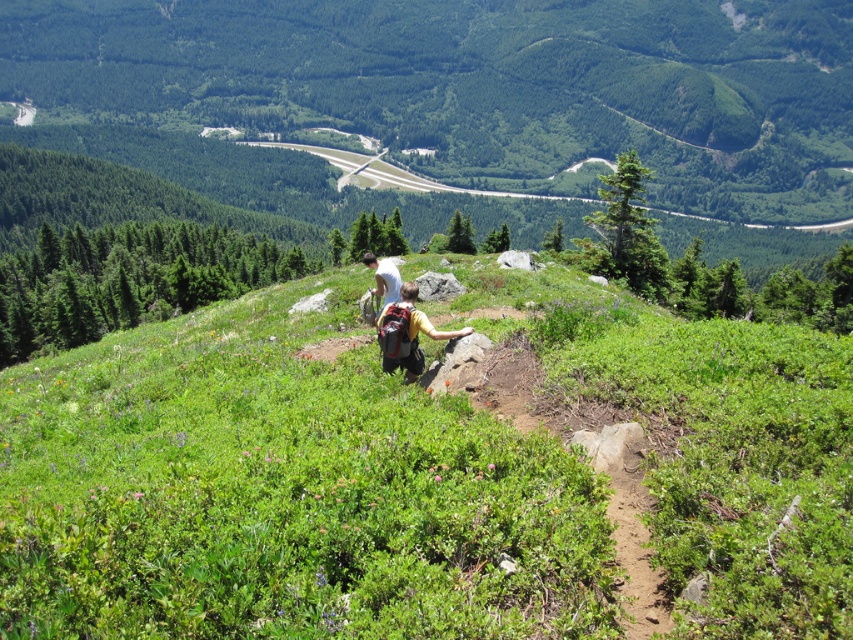
Question: Is matte yellow backpack at center to the left of yellow fabric backpack at center from the viewer's perspective?

Choices:
 (A) no
 (B) yes

Answer: (A)

Question: Which of the following is the farthest from the observer?

Choices:
 (A) (454, 452)
 (B) (413, 326)
 (C) (380, 266)

Answer: (C)

Question: Does matte yellow backpack at center appear under yellow fabric backpack at center?

Choices:
 (A) no
 (B) yes

Answer: (B)

Question: Can you confirm if green leafy grass at center is positioned to the left of yellow fabric backpack at center?

Choices:
 (A) no
 (B) yes

Answer: (A)

Question: Which of the following is the farthest from the observer?

Choices:
 (A) (387, 276)
 (B) (550, 570)

Answer: (A)

Question: Based on their relative distances, which object is farther from the yellow fabric backpack at center?

Choices:
 (A) matte yellow backpack at center
 (B) green leafy grass at center

Answer: (A)